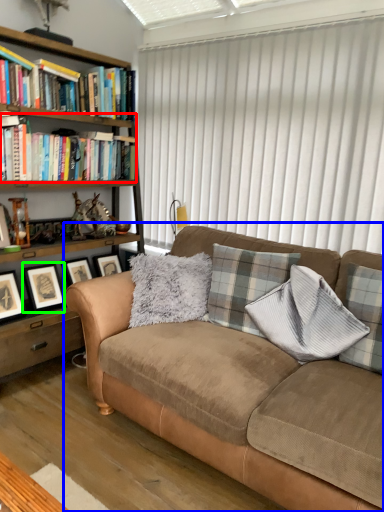
Question: Which object is the farthest from book (highlighted by a red box)? Choose among these: studio couch (highlighted by a blue box) or picture frame (highlighted by a green box).

Choices:
 (A) studio couch
 (B) picture frame

Answer: (A)